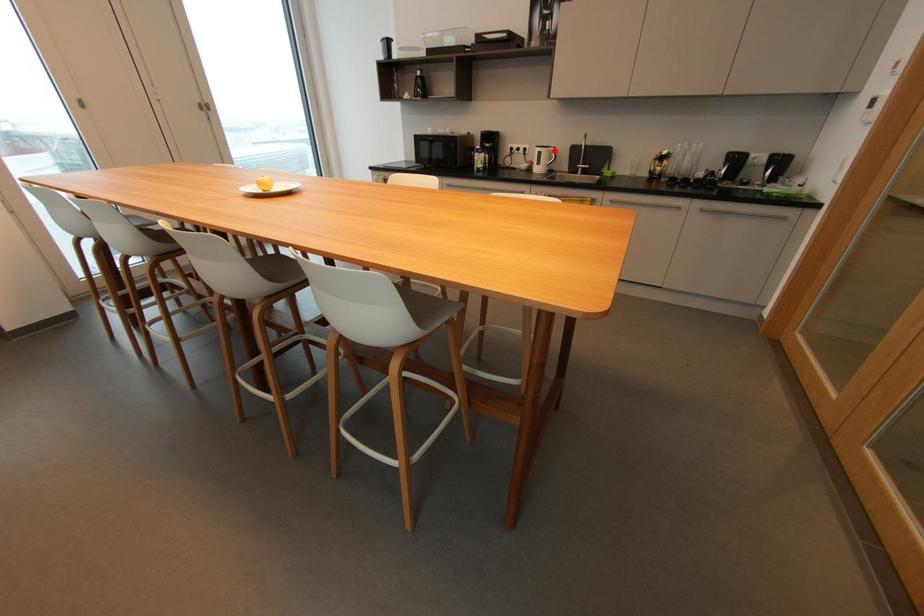
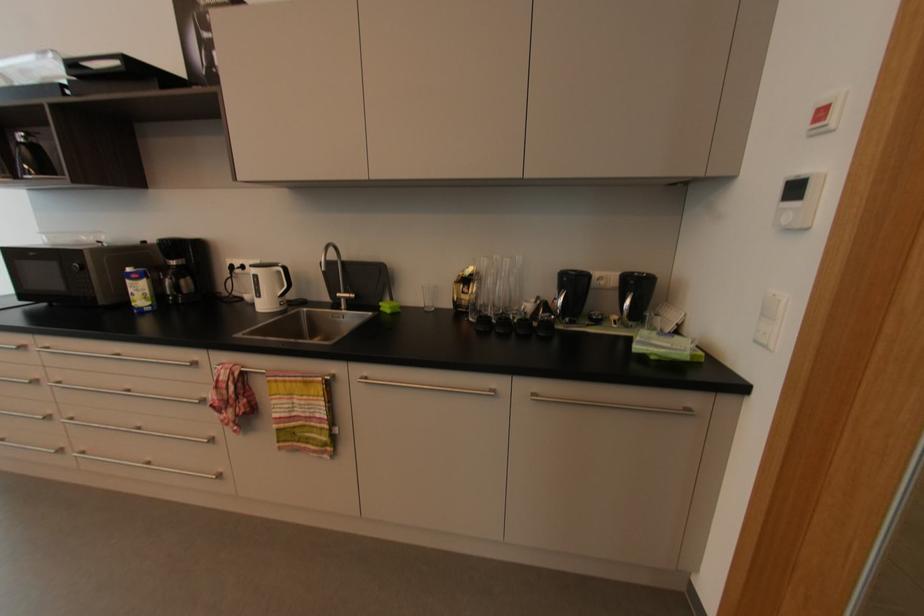
Question: I am providing you with two images of the same scene from different viewpoints. Given a red point in image1, look at the same physical point in image2. Is it:

Choices:
 (A) Closer to the viewpoint
 (B) Farther from the viewpoint

Answer: (B)